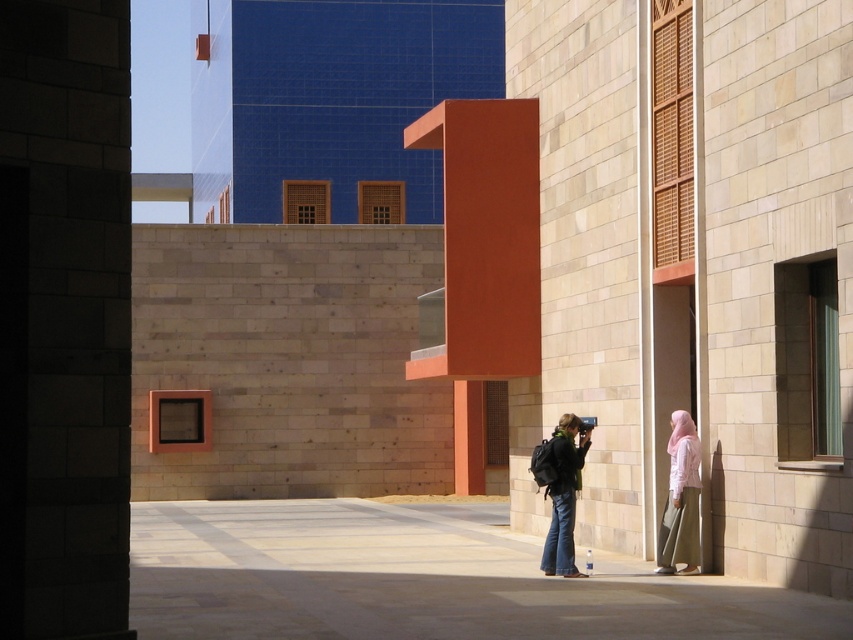
Question: Does matte orange pillar at center come in front of pale pink fabric hijab at lower right?

Choices:
 (A) yes
 (B) no

Answer: (B)

Question: Does matte orange pillar at center have a smaller size compared to denim jeans at center?

Choices:
 (A) no
 (B) yes

Answer: (A)

Question: Which point appears closest to the camera in this image?

Choices:
 (A) (567, 438)
 (B) (518, 157)
 (C) (674, 529)

Answer: (C)

Question: Considering the relative positions of matte orange pillar at center and pale pink fabric hijab at lower right in the image provided, where is matte orange pillar at center located with respect to pale pink fabric hijab at lower right?

Choices:
 (A) right
 (B) left

Answer: (B)

Question: Which point appears closest to the camera in this image?

Choices:
 (A) (677, 556)
 (B) (480, 224)

Answer: (A)

Question: Which object is positioned farthest from the matte orange pillar at center?

Choices:
 (A) pale pink fabric hijab at lower right
 (B) denim jeans at center

Answer: (A)